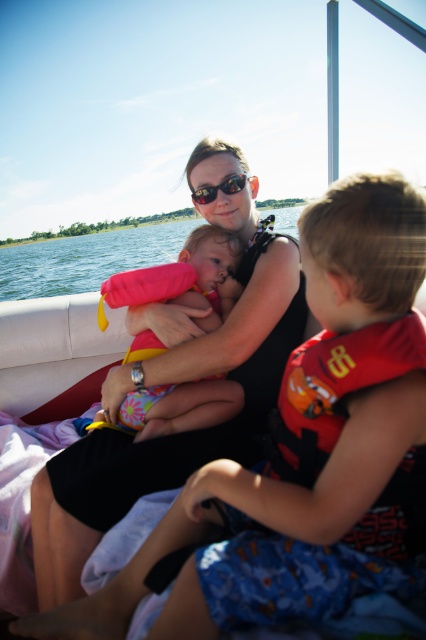
Consider the image. Does matte black swimsuit at center lie in front of pink fabric life vest at center?

That is True.

Is matte black swimsuit at center to the right of pink fabric life vest at center from the viewer's perspective?

Yes, matte black swimsuit at center is to the right of pink fabric life vest at center.

Who is more forward, (229, 440) or (201, 426)?

Point (229, 440)

Where is `matte black swimsuit at center`? matte black swimsuit at center is located at coordinates (172, 381).

From the picture: Is pink fabric life vest at center wider than black plastic sunglasses at center?

Indeed, pink fabric life vest at center has a greater width compared to black plastic sunglasses at center.

Between pink fabric life vest at center and black plastic sunglasses at center, which one appears on the left side from the viewer's perspective?

pink fabric life vest at center

Find the location of a particular element. The width and height of the screenshot is (426, 640). pink fabric life vest at center is located at coordinates (180, 406).

From the picture: Does matte black swimsuit at center appear under black plastic sunglasses at center?

Yes, matte black swimsuit at center is below black plastic sunglasses at center.

Where is `matte black swimsuit at center`? The width and height of the screenshot is (426, 640). matte black swimsuit at center is located at coordinates (172, 381).